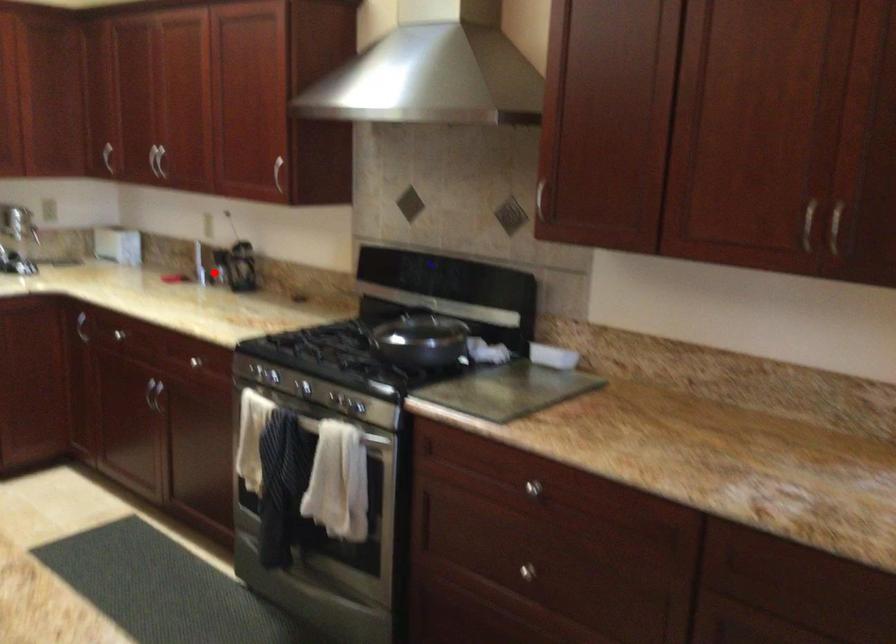
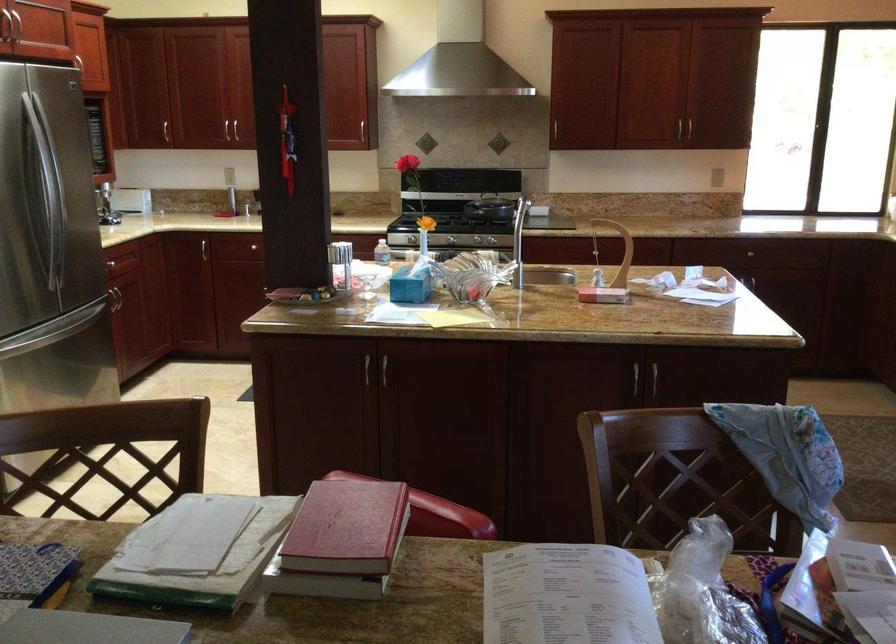
Find the pixel in the second image that matches the highlighted location in the first image.

(202, 205)